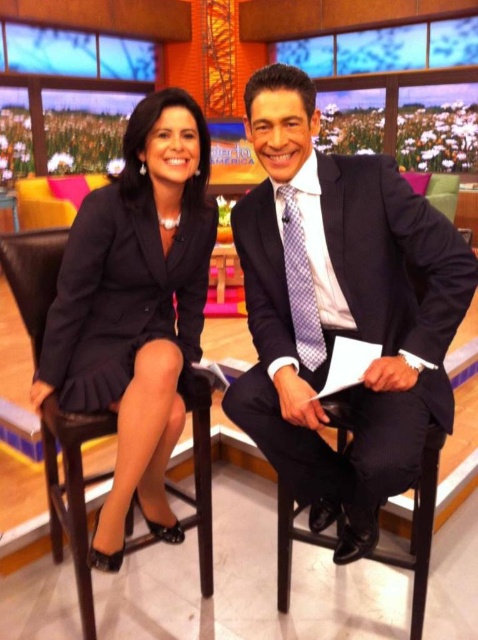
Who is taller, dark blue pinstripe suit at center or purple checkered tie at center?

Standing taller between the two is dark blue pinstripe suit at center.

Who is more forward, [378,451] or [312,333]?

Point [378,451]

Consider the image. Who is more forward, (x=351, y=276) or (x=302, y=328)?

Point (x=351, y=276)

Identify the location of dark blue pinstripe suit at center. (340, 310).

Is matte black dress at left above purple checkered tie at center?

Incorrect, matte black dress at left is not positioned above purple checkered tie at center.

Consider the image. Is matte black dress at left wider than purple checkered tie at center?

Correct, the width of matte black dress at left exceeds that of purple checkered tie at center.

The image size is (478, 640). In order to click on matte black dress at left in this screenshot , I will do 136,307.

Is point (105, 390) farther from camera compared to point (184, 312)?

No, it is in front of (184, 312).

Describe the element at coordinates (136, 307) in the screenshot. I see `matte black dress at left` at that location.

The width and height of the screenshot is (478, 640). I want to click on matte black dress at left, so click(x=136, y=307).